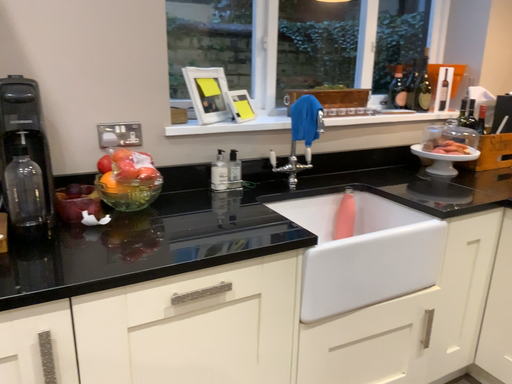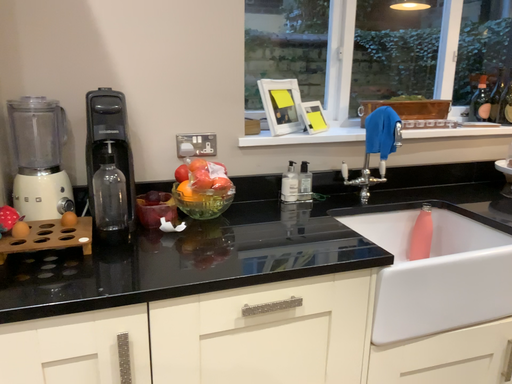
Question: Which way did the camera rotate in the video?

Choices:
 (A) rotated left
 (B) rotated right

Answer: (A)